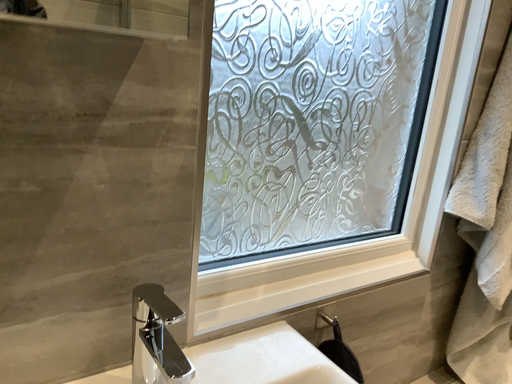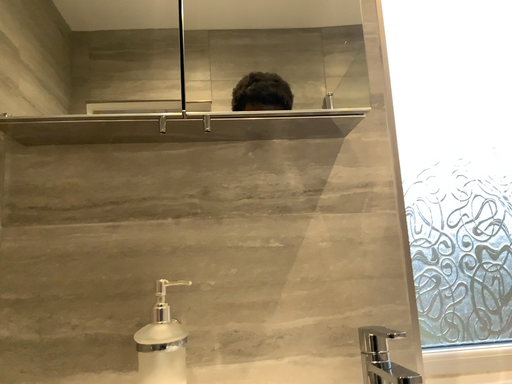
Question: Which way did the camera rotate in the video?

Choices:
 (A) rotated upward
 (B) rotated downward

Answer: (A)